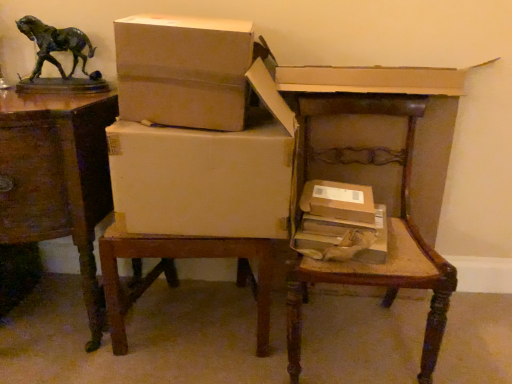
What do you see at coordinates (183, 70) in the screenshot? The height and width of the screenshot is (384, 512). I see `white cardboard box at center, placed as the fourth box when sorted from bottom to top` at bounding box center [183, 70].

Locate an element on the screen. The image size is (512, 384). bronze horse at upper left is located at coordinates [x=55, y=44].

Locate an element on the screen. The height and width of the screenshot is (384, 512). white cardboard box at center, the third box when ordered from bottom to top is located at coordinates (201, 180).

From the image's perspective, which one is positioned higher, white cardboard box at center, placed as the fourth box when sorted from bottom to top, or brown cardboard box at lower right, the fourth box viewed from the top?

white cardboard box at center, placed as the fourth box when sorted from bottom to top, from the image's perspective.

Is white cardboard box at center, the first box in the top-to-bottom sequence, positioned far away from brown cardboard box at lower right, arranged as the 1th box when ordered from the bottom?

white cardboard box at center, the first box in the top-to-bottom sequence, is near brown cardboard box at lower right, arranged as the 1th box when ordered from the bottom, not far away.

Who is bigger, white cardboard box at center, placed as the fourth box when sorted from bottom to top, or brown cardboard box at lower right, the fourth box viewed from the top?

Bigger between the two is white cardboard box at center, placed as the fourth box when sorted from bottom to top.

Could you measure the distance between white cardboard box at center, placed as the fourth box when sorted from bottom to top, and brown cardboard box at lower right, arranged as the 1th box when ordered from the bottom?

white cardboard box at center, placed as the fourth box when sorted from bottom to top, and brown cardboard box at lower right, arranged as the 1th box when ordered from the bottom, are 51.57 centimeters apart.

From a real-world perspective, who is located lower, bronze horse at upper left or brown cardboard box at center, which is counted as the 3th box, starting from the top?

brown cardboard box at center, which is counted as the 3th box, starting from the top.

From the image's perspective, which is below, bronze horse at upper left or brown cardboard box at center, which is counted as the 3th box, starting from the top?

brown cardboard box at center, which is counted as the 3th box, starting from the top.

Can you tell me how much bronze horse at upper left and brown cardboard box at center, which is counted as the 3th box, starting from the top, differ in facing direction?

The facing directions of bronze horse at upper left and brown cardboard box at center, which is counted as the 3th box, starting from the top, are 8.31 degrees apart.

Which object is closer to the camera, bronze horse at upper left or brown cardboard box at center, which is counted as the 3th box, starting from the top?

Positioned in front is brown cardboard box at center, which is counted as the 3th box, starting from the top.

From the image's perspective, which is below, brown cardboard box at center, positioned as the second box in bottom-to-top order, or bronze horse at upper left?

brown cardboard box at center, positioned as the second box in bottom-to-top order, appears lower in the image.

Based on the photo, which object is more forward, brown cardboard box at center, positioned as the second box in bottom-to-top order, or bronze horse at upper left?

brown cardboard box at center, positioned as the second box in bottom-to-top order.

From a real-world perspective, is brown cardboard box at center, which is counted as the 3th box, starting from the top, located higher than bronze horse at upper left?

No, from a real-world perspective, brown cardboard box at center, which is counted as the 3th box, starting from the top, is not above bronze horse at upper left.

Could you tell me if brown cardboard box at center, positioned as the second box in bottom-to-top order, is facing bronze horse at upper left?

No, brown cardboard box at center, positioned as the second box in bottom-to-top order, is not oriented towards bronze horse at upper left.

From a real-world perspective, is wooden table at left located higher than brown cardboard box at lower right, the fourth box viewed from the top?

Incorrect, from a real-world perspective, wooden table at left is lower than brown cardboard box at lower right, the fourth box viewed from the top.

Does wooden table at left come in front of brown cardboard box at lower right, the fourth box viewed from the top?

Yes, wooden table at left is closer to the camera.

From the image's perspective, which object appears higher, wooden table at left or brown cardboard box at lower right, arranged as the 1th box when ordered from the bottom?

wooden table at left.

What's the angular difference between wooden table at left and brown cardboard box at lower right, arranged as the 1th box when ordered from the bottom,'s facing directions?

10.8 degrees.

Is wooden table at left positioned in front of white cardboard box at center, the third box when ordered from bottom to top?

Yes, wooden table at left is in front of white cardboard box at center, the third box when ordered from bottom to top.

Considering the sizes of objects wooden table at left and white cardboard box at center, the third box when ordered from bottom to top, in the image provided, who is smaller, wooden table at left or white cardboard box at center, the third box when ordered from bottom to top,?

Smaller between the two is white cardboard box at center, the third box when ordered from bottom to top.

Does point (92, 150) lie behind point (205, 134)?

Yes, it is.

Is wooden table at left aimed at white cardboard box at center, the third box when ordered from bottom to top?

No, wooden table at left is not oriented towards white cardboard box at center, the third box when ordered from bottom to top.

Who is smaller, white cardboard box at center, placed as the fourth box when sorted from bottom to top, or wooden table at left?

white cardboard box at center, placed as the fourth box when sorted from bottom to top.

Is wooden table at left a part of white cardboard box at center, the first box in the top-to-bottom sequence?

No, wooden table at left is not a part of white cardboard box at center, the first box in the top-to-bottom sequence.

Visually, is white cardboard box at center, the first box in the top-to-bottom sequence, positioned to the left or to the right of wooden table at left?

white cardboard box at center, the first box in the top-to-bottom sequence, is positioned on wooden table at left's right side.

Which is in front, point (364, 212) or point (189, 66)?

The point (189, 66) is closer to the camera.

Choose the correct answer: Is brown cardboard box at center, positioned as the second box in bottom-to-top order, inside white cardboard box at center, the first box in the top-to-bottom sequence, or outside it?

The correct answer is: outside.

How many degrees apart are the facing directions of brown cardboard box at center, which is counted as the 3th box, starting from the top, and white cardboard box at center, placed as the fourth box when sorted from bottom to top?

brown cardboard box at center, which is counted as the 3th box, starting from the top, and white cardboard box at center, placed as the fourth box when sorted from bottom to top, are facing 11.5 degrees away from each other.

Is brown cardboard box at center, which is counted as the 3th box, starting from the top, aimed at white cardboard box at center, placed as the fourth box when sorted from bottom to top?

No.

I want to click on box that is the 2nd one when counting forward from the brown cardboard box at lower right, the fourth box viewed from the top, so click(183, 70).

Find the location of a particular element. The height and width of the screenshot is (384, 512). animal that is on the left side of brown cardboard box at center, which is counted as the 3th box, starting from the top is located at coordinates (55, 44).

Estimate the real-world distances between objects in this image. Which object is further from white cardboard box at center, the third box when ordered from bottom to top, wooden chair at center or wooden table at left?

wooden chair at center lies further to white cardboard box at center, the third box when ordered from bottom to top, than the other object.

Which object lies nearer to the anchor point brown cardboard box at lower right, the fourth box viewed from the top, bronze horse at upper left or wooden table at left?

The object closer to brown cardboard box at lower right, the fourth box viewed from the top, is wooden table at left.

Based on their spatial positions, is white cardboard box at center, which appears as the second box when viewed from the top, or wooden chair at center closer to white cardboard box at center, the first box in the top-to-bottom sequence?

white cardboard box at center, which appears as the second box when viewed from the top, is positioned closer to the anchor white cardboard box at center, the first box in the top-to-bottom sequence.

Based on their spatial positions, is wooden table at left or brown cardboard box at lower right, the fourth box viewed from the top, further from bronze horse at upper left?

The object further to bronze horse at upper left is brown cardboard box at lower right, the fourth box viewed from the top.

When comparing their distances from brown cardboard box at lower right, the fourth box viewed from the top, does wooden chair at center or wooden table at left seem closer?

wooden chair at center lies closer to brown cardboard box at lower right, the fourth box viewed from the top, than the other object.

Looking at the image, which one is located closer to white cardboard box at center, the first box in the top-to-bottom sequence, wooden table at left or wooden chair at center?

wooden table at left lies closer to white cardboard box at center, the first box in the top-to-bottom sequence, than the other object.

Estimate the real-world distances between objects in this image. Which object is closer to wooden chair at center, bronze horse at upper left or brown cardboard box at center, positioned as the second box in bottom-to-top order?

brown cardboard box at center, positioned as the second box in bottom-to-top order, is positioned closer to the anchor wooden chair at center.

Based on their spatial positions, is brown cardboard box at center, positioned as the second box in bottom-to-top order, or wooden chair at center closer to wooden table at left?

brown cardboard box at center, positioned as the second box in bottom-to-top order, lies closer to wooden table at left than the other object.

This screenshot has height=384, width=512. Identify the location of box between wooden table at left and white cardboard box at center, the third box when ordered from bottom to top. (183, 70).

Identify the location of animal between wooden table at left and white cardboard box at center, the first box in the top-to-bottom sequence, in the horizontal direction. The height and width of the screenshot is (384, 512). (55, 44).

Image resolution: width=512 pixels, height=384 pixels. Find the location of `box between bronze horse at upper left and white cardboard box at center, which appears as the second box when viewed from the top, from left to right`. box between bronze horse at upper left and white cardboard box at center, which appears as the second box when viewed from the top, from left to right is located at coordinates (183, 70).

Identify the location of animal between wooden table at left and wooden chair at center from left to right. (55, 44).